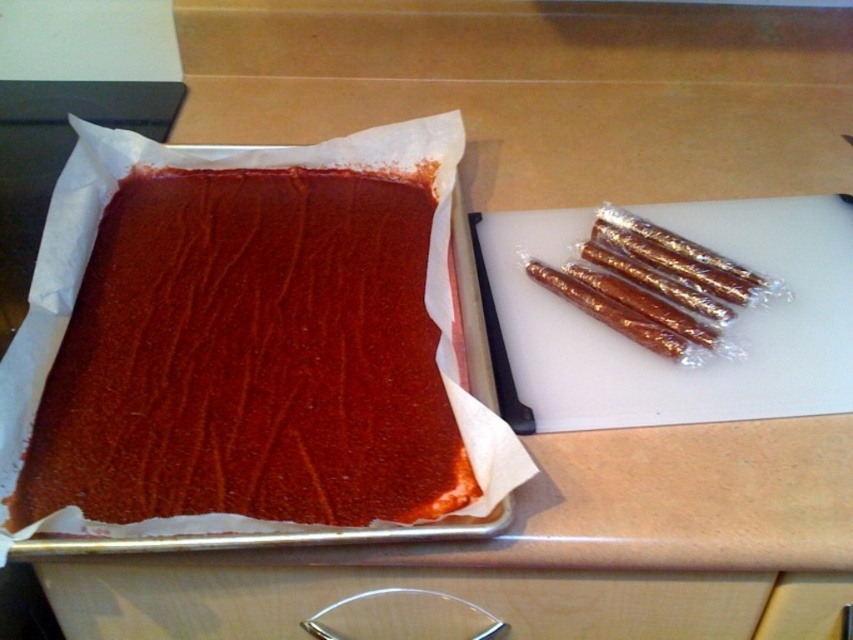
You are organizing the kitchen and need to place a new spice jar between the smooth chocolate cake at center and the wooden drawer handle at lower center. Based on their positions, where should you place the spice jar?

The smooth chocolate cake at center is to the left of the wooden drawer handle at lower center. Therefore, to place the spice jar between them, it should be positioned to the right of the smooth chocolate cake at center and to the left of the wooden drawer handle at lower center.

You are looking at the baking tray on the left side of the image. There are two points marked on it. One is at coordinate point (448, 570) and the other is at point (613, 300). If you were to place a chocolate chip cookie dough ball on the baking tray, which point would be closer to you?

Point (448, 570) is closer to the camera than point (613, 300), so placing the cookie dough ball there would make it appear closer to you.